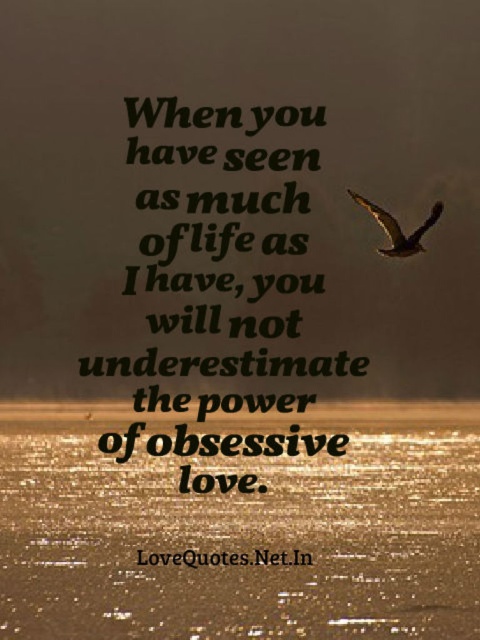
Question: Which object is farther from the camera taking this photo?

Choices:
 (A) brown feathered bird at upper right
 (B) black paper quote at center

Answer: (A)

Question: Does shiny metallic water at bottom have a greater width compared to black paper quote at center?

Choices:
 (A) yes
 (B) no

Answer: (A)

Question: Estimate the real-world distances between objects in this image. Which object is closer to the shiny metallic water at bottom?

Choices:
 (A) brown feathered bird at upper right
 (B) black paper quote at center

Answer: (B)

Question: Which object appears closest to the camera in this image?

Choices:
 (A) brown feathered bird at upper right
 (B) black paper quote at center

Answer: (B)

Question: Is shiny metallic water at bottom thinner than black text at center?

Choices:
 (A) yes
 (B) no

Answer: (B)

Question: Can you confirm if shiny metallic water at bottom is smaller than black text at center?

Choices:
 (A) no
 (B) yes

Answer: (A)